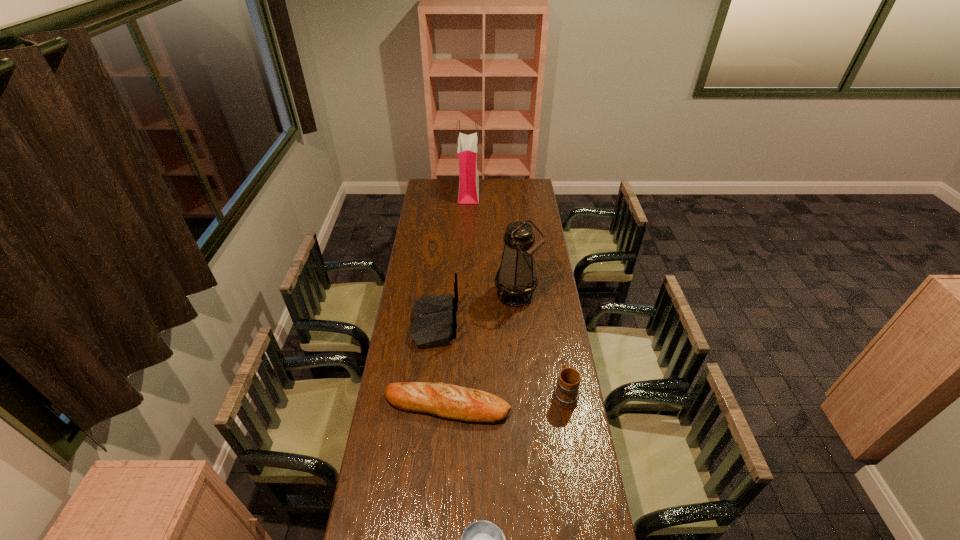
What are the coordinates of `free location at the far left corner` in the screenshot? It's located at (424, 190).

Identify the location of free space that is in between the oil lamp and the mug. (540, 345).

This screenshot has width=960, height=540. Find the location of `vacant space in between the oil lamp and the baguet`. vacant space in between the oil lamp and the baguet is located at coordinates (482, 350).

Locate an element on the screen. Image resolution: width=960 pixels, height=540 pixels. unoccupied position between the fourth shortest object and the mug is located at coordinates (500, 359).

Locate an element on the screen. This screenshot has width=960, height=540. free area in between the fourth shortest object and the oil lamp is located at coordinates (476, 309).

I want to click on empty space that is in between the third shortest object and the oil lamp, so click(540, 345).

Identify the location of object that stands as the closest to the farthest object. This screenshot has height=540, width=960. (516, 279).

Locate an element on the screen. The width and height of the screenshot is (960, 540). object that is the fifth closest one to the oil lamp is located at coordinates tap(482, 539).

The image size is (960, 540). I want to click on free space that satisfies the following two spatial constraints: 1. on the back of the baguet; 2. on the left side of the router, so click(426, 406).

You are a GUI agent. You are given a task and a screenshot of the screen. Output one action in this format:
    pyautogui.click(x=<x>, y=<y>)
    Task: Click on the free location that satisfies the following two spatial constraints: 1. on the front-facing side of the shopping bag; 2. on the side of the third shortest object with the handle
    
    Given the screenshot: What is the action you would take?
    pyautogui.click(x=462, y=394)